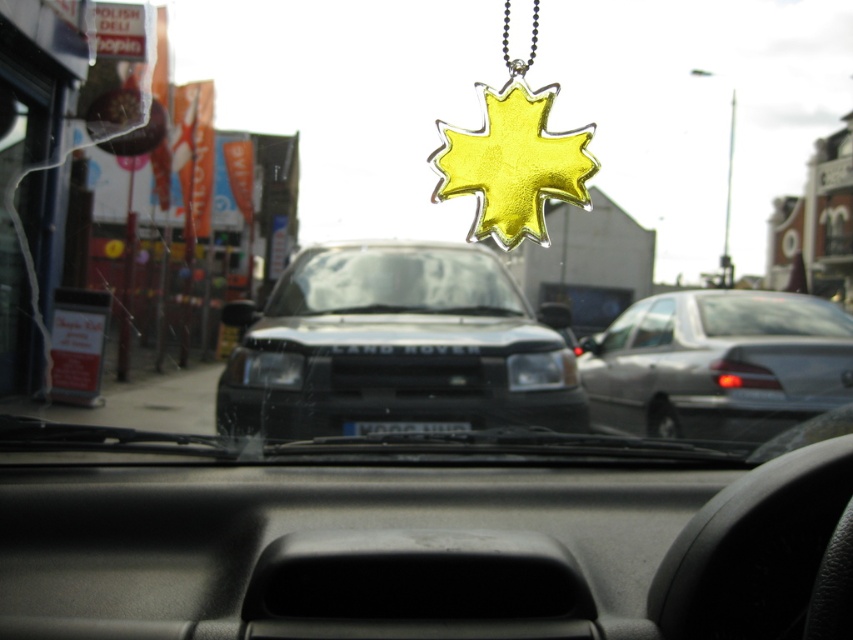
Question: Does matte black land rover at center appear over transparent glass windshield at center?

Choices:
 (A) no
 (B) yes

Answer: (A)

Question: Which point is closer to the camera?

Choices:
 (A) (459, 397)
 (B) (416, 432)
 (C) (817, 317)

Answer: (B)

Question: Which object is closer to the camera taking this photo?

Choices:
 (A) transparent glass windshield at center
 (B) black plastic license plate at center
 (C) matte black land rover at center

Answer: (C)

Question: Which point is farther from the camera taking this photo?

Choices:
 (A) (331, 333)
 (B) (354, 301)
 (C) (780, 310)
 (D) (352, 428)

Answer: (B)

Question: Is matte black land rover at center bigger than transparent glass windshield at center?

Choices:
 (A) no
 (B) yes

Answer: (B)

Question: Can you confirm if transparent glass windshield at center is positioned to the left of clear glass car window at center?

Choices:
 (A) no
 (B) yes

Answer: (B)